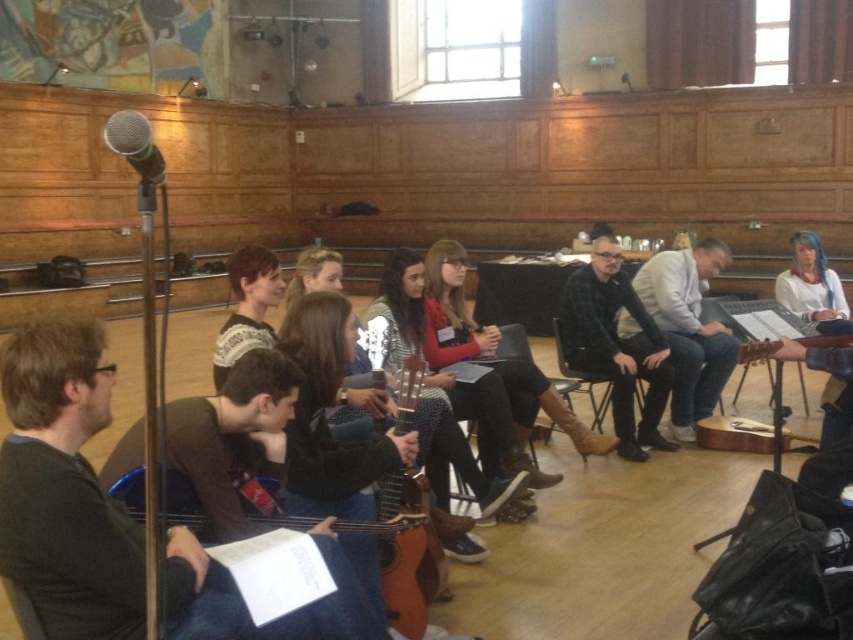
Question: Is acoustic wood guitar at lower left positioned at the back of silver metallic microphone at upper left?

Choices:
 (A) no
 (B) yes

Answer: (B)

Question: Can you confirm if plaid fabric shirt at center is smaller than white fabric shirt at upper right?

Choices:
 (A) no
 (B) yes

Answer: (B)

Question: Considering the relative positions of white fabric shirt at upper right and silver metallic microphone at upper left in the image provided, where is white fabric shirt at upper right located with respect to silver metallic microphone at upper left?

Choices:
 (A) left
 (B) right

Answer: (B)

Question: Among these points, which one is nearest to the camera?

Choices:
 (A) (607, 301)
 (B) (805, 250)
 (C) (410, 534)

Answer: (C)

Question: Which object appears farthest from the camera in this image?

Choices:
 (A) plaid fabric shirt at center
 (B) silver metallic microphone at upper left
 (C) white fabric shirt at upper right

Answer: (C)

Question: Which of the following is the closest to the observer?

Choices:
 (A) acoustic wood guitar at lower left
 (B) plaid fabric shirt at center
 (C) silver metallic microphone at upper left

Answer: (C)